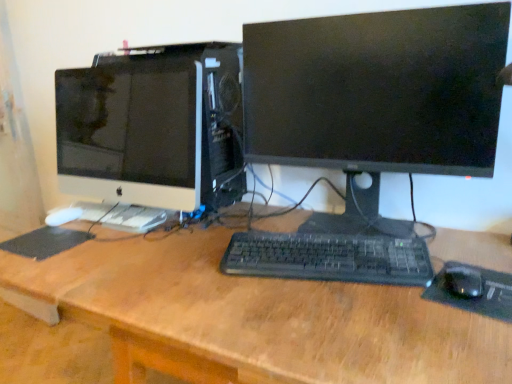
I want to click on free space to the left of black matte monitor at center, the second computer monitor from the left, so click(176, 268).